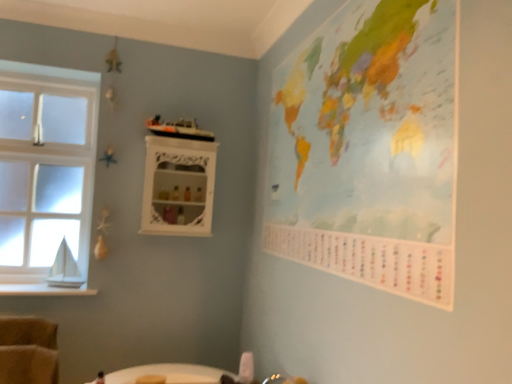
Question: Does clear glass window at left have a smaller size compared to painted paper map at upper right?

Choices:
 (A) yes
 (B) no

Answer: (B)

Question: Does clear glass window at left appear on the left side of painted paper map at upper right?

Choices:
 (A) yes
 (B) no

Answer: (A)

Question: Is clear glass window at left positioned behind painted paper map at upper right?

Choices:
 (A) no
 (B) yes

Answer: (B)

Question: From the image's perspective, is clear glass window at left below painted paper map at upper right?

Choices:
 (A) no
 (B) yes

Answer: (B)

Question: Could painted paper map at upper right be considered to be inside clear glass window at left?

Choices:
 (A) no
 (B) yes

Answer: (A)

Question: Is clear glass window at left far from painted paper map at upper right?

Choices:
 (A) yes
 (B) no

Answer: (A)

Question: Is clear glass window at left positioned before white wood at left?

Choices:
 (A) yes
 (B) no

Answer: (B)

Question: Does clear glass window at left appear on the right side of white wood at left?

Choices:
 (A) yes
 (B) no

Answer: (B)

Question: From the image's perspective, would you say clear glass window at left is shown under white wood at left?

Choices:
 (A) yes
 (B) no

Answer: (B)

Question: Is clear glass window at left not within white wood at left?

Choices:
 (A) yes
 (B) no

Answer: (A)

Question: Is clear glass window at left shorter than white wood at left?

Choices:
 (A) no
 (B) yes

Answer: (A)

Question: Considering the relative sizes of clear glass window at left and white wood at left in the image provided, is clear glass window at left smaller than white wood at left?

Choices:
 (A) no
 (B) yes

Answer: (A)

Question: Does painted paper map at upper right lie in front of white glossy cabinet at upper center?

Choices:
 (A) no
 (B) yes

Answer: (B)